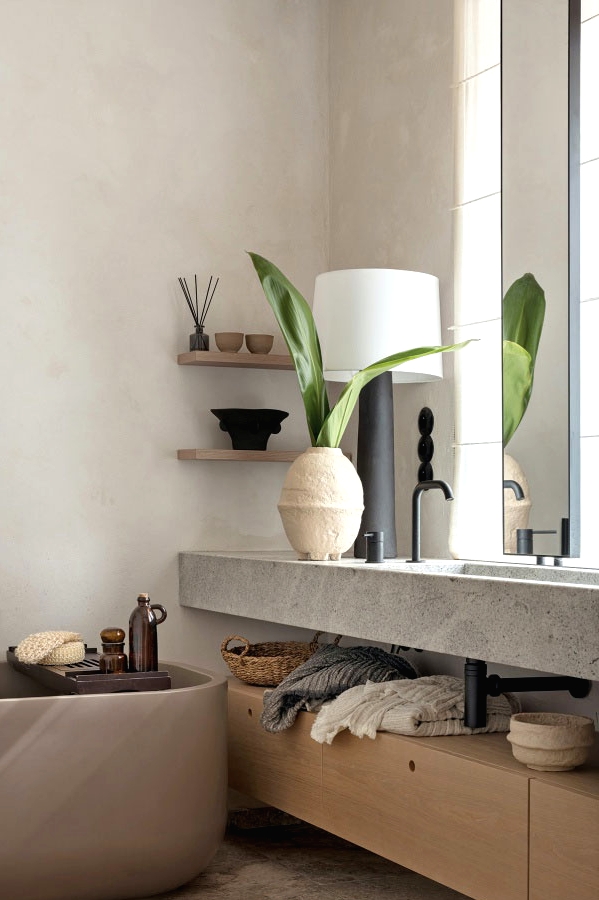
You are a GUI agent. You are given a task and a screenshot of the screen. Output one action in this format:
    pyautogui.click(x=<x>, y=<y>)
    Task: Click on the faucet spout
    The height and width of the screenshot is (900, 599).
    Given the screenshot: What is the action you would take?
    pyautogui.click(x=444, y=488)